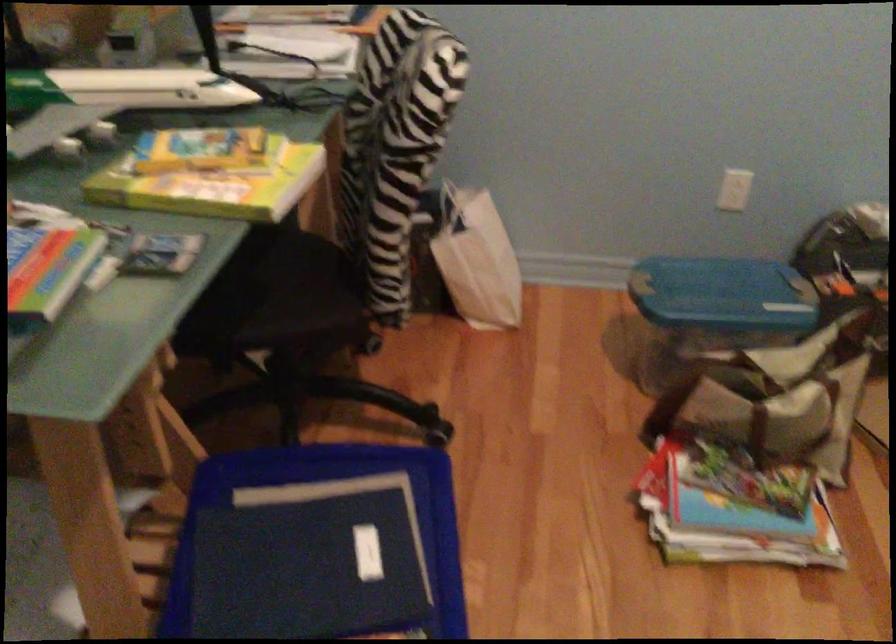
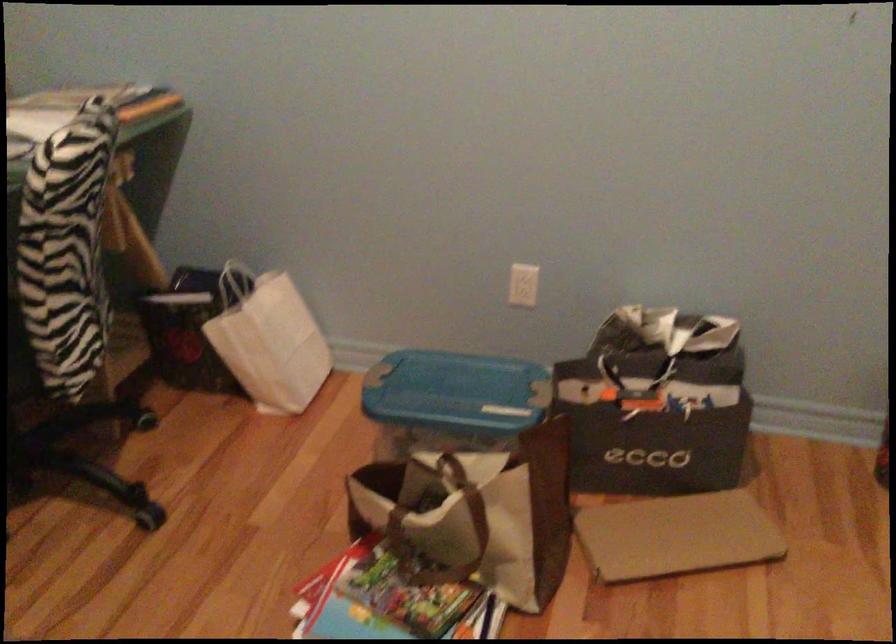
The point at (452, 196) is marked in the first image. Where is the corresponding point in the second image?

(236, 281)